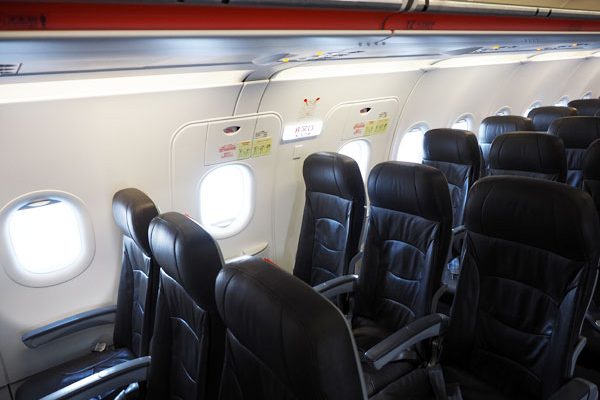
Find the location of a particular element. windows is located at coordinates (43, 228), (229, 182), (356, 146), (421, 143), (455, 122), (504, 113), (535, 110), (558, 105), (587, 102).